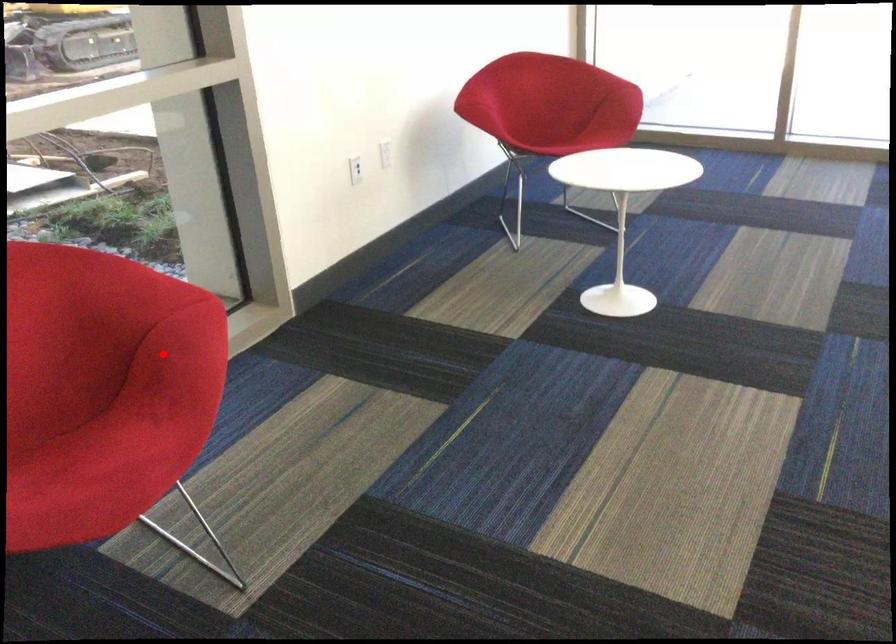
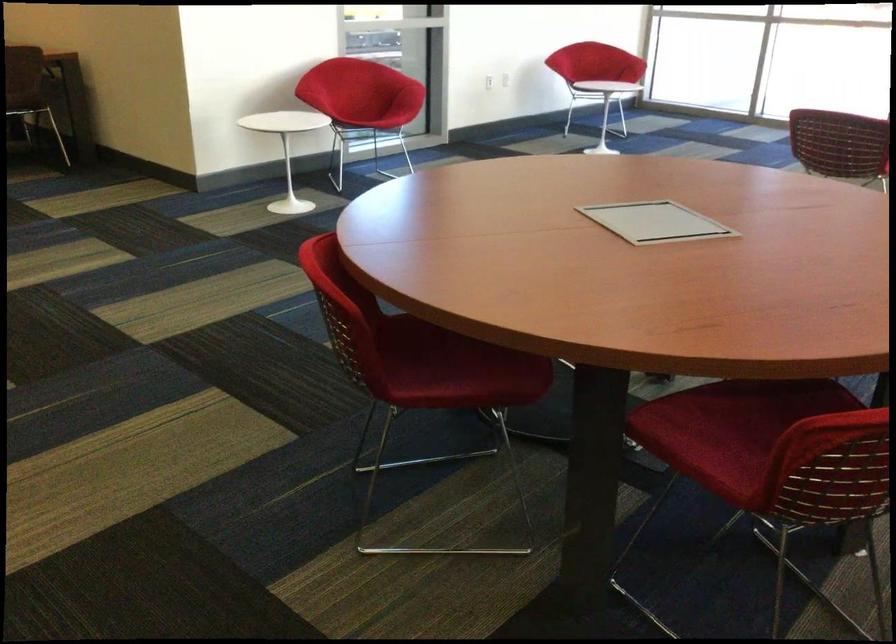
Question: I am providing you with two images of the same scene from different viewpoints. A red point is shown in image1. For the corresponding object point in image2, is it positioned nearer or farther from the camera?

Choices:
 (A) Nearer
 (B) Farther

Answer: (B)